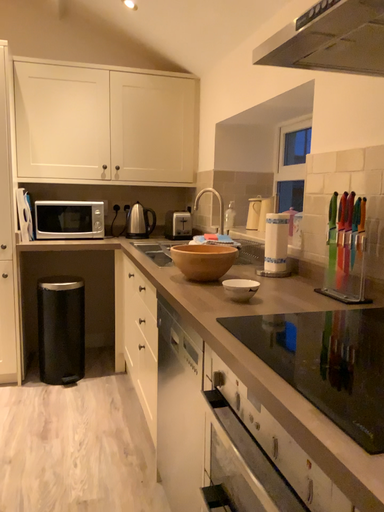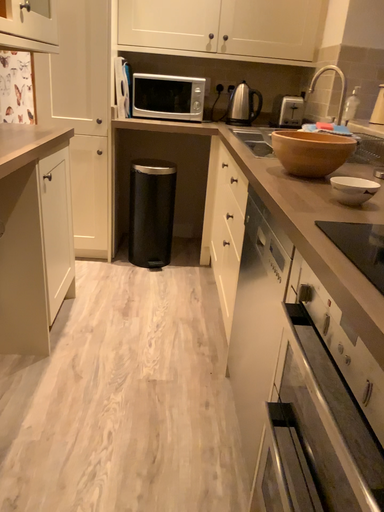
Question: Which way did the camera rotate in the video?

Choices:
 (A) rotated downward
 (B) rotated upward

Answer: (A)